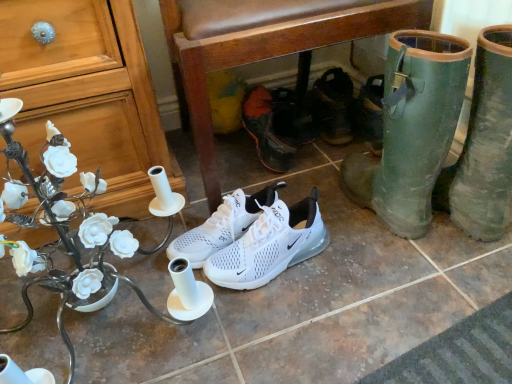
Question: From the image's perspective, is matte white desk at center above or below white mesh sneakers at center, arranged as the 3th footwear when viewed from the front?

Choices:
 (A) below
 (B) above

Answer: (B)

Question: Is matte white desk at center inside the boundaries of white mesh sneakers at center, arranged as the 3th footwear when viewed from the front, or outside?

Choices:
 (A) inside
 (B) outside

Answer: (B)

Question: Which object is positioned farthest from the black leather sandals at center, placed as the fifth footwear when sorted from front to back?

Choices:
 (A) white mesh sneakers at center, marked as the third footwear in a back-to-front arrangement
 (B) matte wood cabinet at left
 (C) green rubber boots at lower right, marked as the fifth footwear in a back-to-front arrangement
 (D) white mesh sneakers at center, the 4th footwear from the back
 (E) brown leather chair at center

Answer: (B)

Question: Estimate the real-world distances between objects in this image. Which object is farther from the green rubber boots at lower right, the first footwear from the front?

Choices:
 (A) matte white desk at center
 (B) matte wood cabinet at left
 (C) white mesh sneakers at center, the 4th footwear from the back
 (D) white mesh sneakers at center, arranged as the 3th footwear when viewed from the front
 (E) brown leather chair at center

Answer: (A)